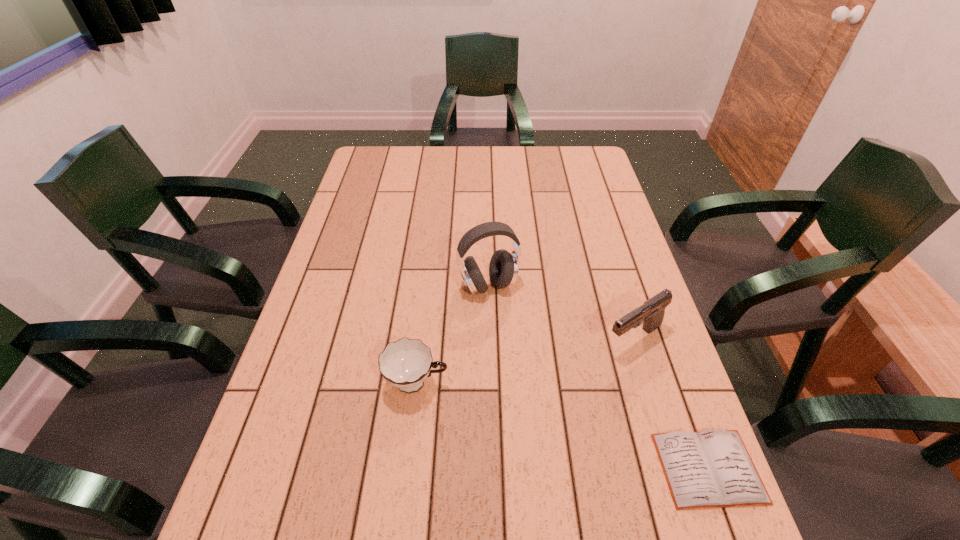
Find the location of a particular element. the third farthest object is located at coordinates (405, 364).

Identify the location of the leftmost object. This screenshot has width=960, height=540. (405, 364).

This screenshot has width=960, height=540. Identify the location of diary. (710, 469).

Locate an element on the screen. The image size is (960, 540). the shortest object is located at coordinates (710, 469).

The width and height of the screenshot is (960, 540). Find the location of `the third object from right to left`. the third object from right to left is located at coordinates (503, 269).

Identify the location of headset. The height and width of the screenshot is (540, 960). (503, 269).

The height and width of the screenshot is (540, 960). Identify the location of pistol. (651, 314).

You are a GUI agent. You are given a task and a screenshot of the screen. Output one action in this format:
    pyautogui.click(x=<x>, y=<y>)
    Task: Click on the second farthest object
    Image resolution: width=960 pixels, height=540 pixels.
    Given the screenshot: What is the action you would take?
    pyautogui.click(x=651, y=314)

At what (x,y) coordinates should I click in order to perform the action: click on free location located 0.260m on the side of the leftmost object with the handle. Please return your answer as a coordinate pair (x, y). Image resolution: width=960 pixels, height=540 pixels. Looking at the image, I should click on (565, 383).

This screenshot has width=960, height=540. Find the location of `vacant area situated 0.190m on the back of the diary`. vacant area situated 0.190m on the back of the diary is located at coordinates (667, 354).